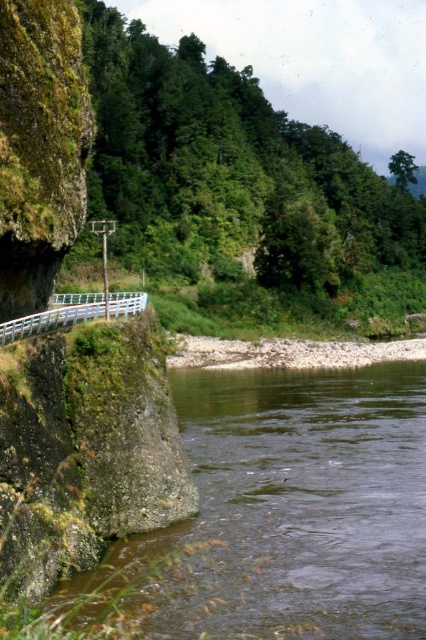
Question: Can you confirm if green mossy rock at lower left is positioned to the right of white plastic railing at lower left?

Choices:
 (A) no
 (B) yes

Answer: (B)

Question: Which of the following is the closest to the observer?

Choices:
 (A) (129, 291)
 (B) (270, 596)

Answer: (B)

Question: Is green mossy rock at lower left thinner than white plastic railing at lower left?

Choices:
 (A) no
 (B) yes

Answer: (A)

Question: Is green mossy rock at lower left further to the viewer compared to white plastic railing at lower left?

Choices:
 (A) no
 (B) yes

Answer: (A)

Question: Which point is farther from the camera taking this photo?

Choices:
 (A) (362, 417)
 (B) (34, 324)

Answer: (A)